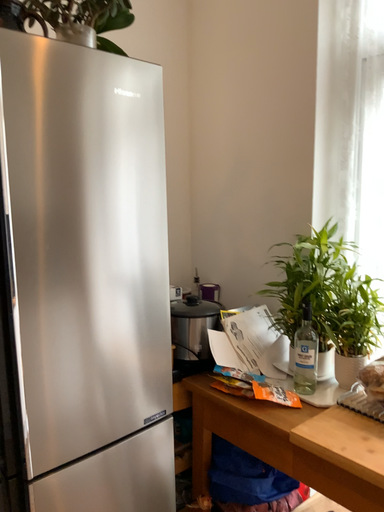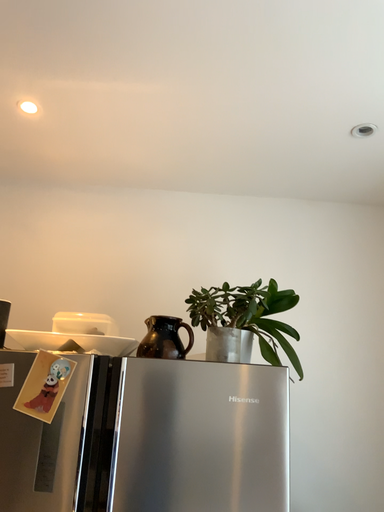
Question: How did the camera likely rotate when shooting the video?

Choices:
 (A) rotated left
 (B) rotated right

Answer: (A)